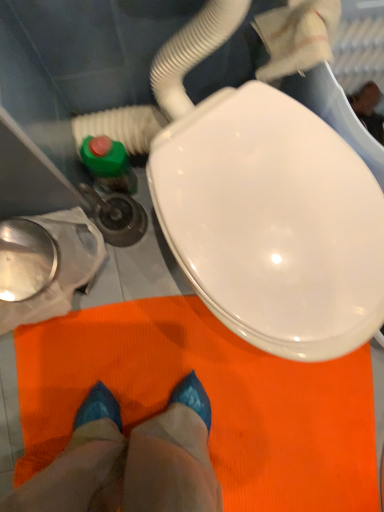
Image resolution: width=384 pixels, height=512 pixels. In order to click on green plastic water pipe at left in this screenshot , I will do `click(121, 127)`.

This screenshot has width=384, height=512. What do you see at coordinates (121, 127) in the screenshot? I see `green plastic water pipe at left` at bounding box center [121, 127].

In order to face green plastic water pipe at left, should I rotate leftwards or rightwards?

To align with it, rotate left about 9.750°.

What do you see at coordinates (130, 460) in the screenshot? This screenshot has height=512, width=384. I see `blue glossy shoes at center` at bounding box center [130, 460].

What is the approximate width of blue glossy shoes at center?

27.24 inches.

You are a GUI agent. You are given a task and a screenshot of the screen. Output one action in this format:
    pyautogui.click(x=<x>, y=<y>)
    Task: Click on the blue glossy shoes at center
    The width and height of the screenshot is (384, 512).
    Given the screenshot: What is the action you would take?
    pyautogui.click(x=130, y=460)

Locate an element on the screen. The image size is (384, 512). green plastic water pipe at left is located at coordinates (121, 127).

Is blue glossy shoes at center to the left of green plastic water pipe at left from the viewer's perspective?

No, blue glossy shoes at center is not to the left of green plastic water pipe at left.

Relative to green plastic water pipe at left, is blue glossy shoes at center in front or behind?

blue glossy shoes at center is behind green plastic water pipe at left.

Which point is more forward, (44,504) or (75,119)?

The point (44,504) is more forward.

In the scene shown: From the image's perspective, between blue glossy shoes at center and green plastic water pipe at left, which one is located above?

green plastic water pipe at left.

From a real-world perspective, who is located higher, blue glossy shoes at center or green plastic water pipe at left?

From a 3D spatial view, green plastic water pipe at left is above.

Considering the relative sizes of blue glossy shoes at center and green plastic water pipe at left in the image provided, is blue glossy shoes at center wider than green plastic water pipe at left?

Yes, blue glossy shoes at center is wider than green plastic water pipe at left.

Does blue glossy shoes at center have a greater height compared to green plastic water pipe at left?

Incorrect, the height of blue glossy shoes at center is not larger of that of green plastic water pipe at left.

Considering the sizes of objects blue glossy shoes at center and green plastic water pipe at left in the image provided, who is bigger, blue glossy shoes at center or green plastic water pipe at left?

blue glossy shoes at center is bigger.

Is green plastic water pipe at left a part of blue glossy shoes at center?

No, green plastic water pipe at left is located outside of blue glossy shoes at center.

Is blue glossy shoes at center placed right next to green plastic water pipe at left?

blue glossy shoes at center and green plastic water pipe at left are clearly separated.

Could you tell me if blue glossy shoes at center is facing green plastic water pipe at left?

No, blue glossy shoes at center does not turn towards green plastic water pipe at left.

What's the angular difference between blue glossy shoes at center and green plastic water pipe at left's facing directions?

The angle between the facing direction of blue glossy shoes at center and the facing direction of green plastic water pipe at left is 97.3 degrees.

Where is `person lying below the green plastic water pipe at left (from the image's perspective)`? The width and height of the screenshot is (384, 512). person lying below the green plastic water pipe at left (from the image's perspective) is located at coordinates (130, 460).

Considering the positions of objects green plastic water pipe at left and blue glossy shoes at center in the image provided, who is more to the left, green plastic water pipe at left or blue glossy shoes at center?

Positioned to the left is green plastic water pipe at left.

Relative to blue glossy shoes at center, is green plastic water pipe at left in front or behind?

In the image, green plastic water pipe at left appears in front of blue glossy shoes at center.

Considering the points (91, 124) and (156, 455), which point is behind, point (91, 124) or point (156, 455)?

The point (91, 124) is farther.

From the image's perspective, which one is positioned higher, green plastic water pipe at left or blue glossy shoes at center?

green plastic water pipe at left appears higher in the image.

From a real-world perspective, which is physically below, green plastic water pipe at left or blue glossy shoes at center?

blue glossy shoes at center.

In terms of width, does green plastic water pipe at left look wider or thinner when compared to blue glossy shoes at center?

Considering their sizes, green plastic water pipe at left looks slimmer than blue glossy shoes at center.

Does green plastic water pipe at left have a lesser height compared to blue glossy shoes at center?

Incorrect, the height of green plastic water pipe at left does not fall short of that of blue glossy shoes at center.

Based on their sizes in the image, would you say green plastic water pipe at left is bigger or smaller than blue glossy shoes at center?

In the image, green plastic water pipe at left appears to be smaller than blue glossy shoes at center.

Is green plastic water pipe at left outside of blue glossy shoes at center?

Indeed, green plastic water pipe at left is completely outside blue glossy shoes at center.

Is green plastic water pipe at left not near blue glossy shoes at center?

No.

Is green plastic water pipe at left facing towards blue glossy shoes at center?

No, green plastic water pipe at left is not facing towards blue glossy shoes at center.

The height and width of the screenshot is (512, 384). I want to click on person behind the green plastic water pipe at left, so click(x=130, y=460).

Find the location of a particular element. This screenshot has width=384, height=512. person on the right of green plastic water pipe at left is located at coordinates (130, 460).

In the image, there is a green plastic water pipe at left. Identify the location of person below it (from a real-world perspective). (130, 460).